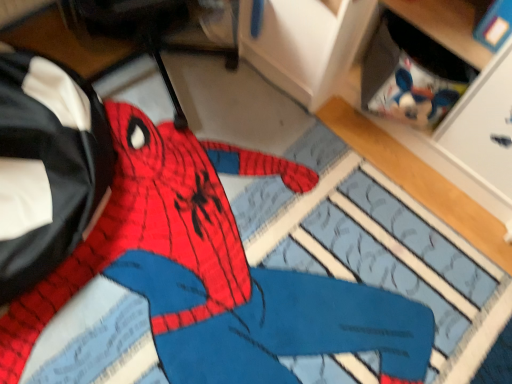
The image size is (512, 384). I want to click on free region under knitted fabric spiderman at center (from a real-world perspective), so click(246, 268).